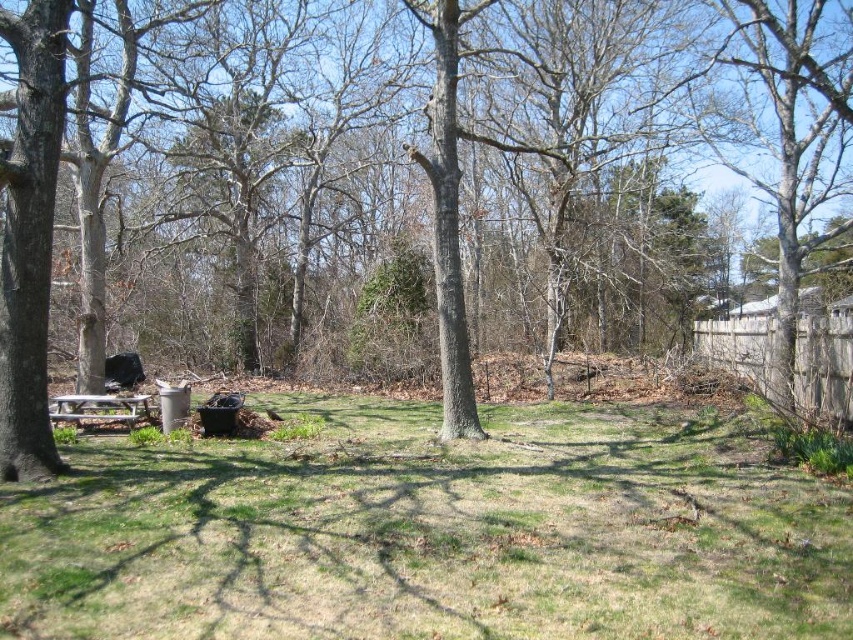
Based on the photo, you are planning to set up a garden between the wooden fence at right and the wooden picnic table at lower left. Given that the distance between them is 10.48 meters, what is the maximum length of a garden bed you can place between them without exceeding the space?

The maximum length of a garden bed you can place between the wooden fence at right and the wooden picnic table at lower left is 10.48 meters, as that is the distance between them.

You are planning to set up a small garden in the backyard. You have a garden bed that is the same size as the green grassy at center. Will the garden bed fit within the area of the wooden fence at right?

The green grassy at center has a smaller size compared to wooden fence at right, so the garden bed will fit within the area of the wooden fence at right since it is smaller in size.